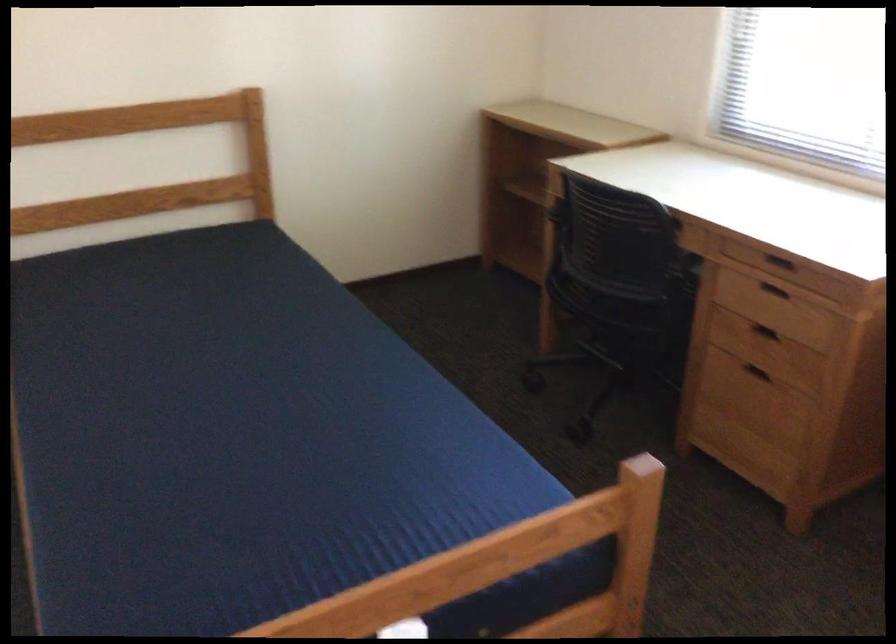
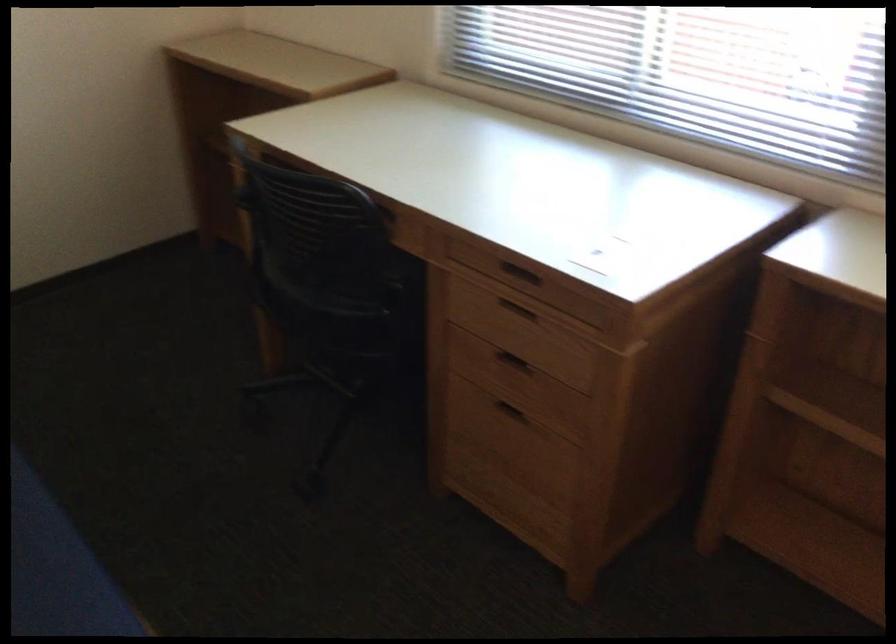
Question: The images are taken continuously from a first-person perspective. In which direction is your viewpoint rotating?

Choices:
 (A) Left
 (B) Right
 (C) Up
 (D) Down

Answer: (B)